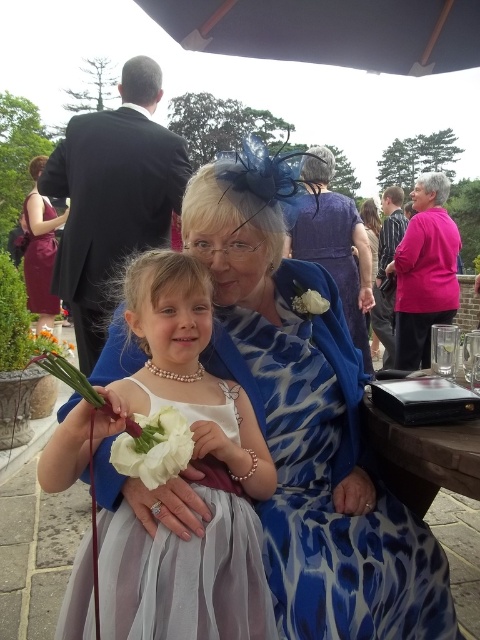
Question: Can you confirm if blue textured dress at center is positioned above white satin dress at lower left?

Choices:
 (A) no
 (B) yes

Answer: (A)

Question: Which of these objects is positioned farthest from the blue textured dress at center?

Choices:
 (A) white silk flower at lower left
 (B) white silk flower at center
 (C) white satin dress at center

Answer: (A)

Question: Which point is closer to the camera?

Choices:
 (A) white satin dress at lower left
 (B) white silk flower at lower left

Answer: (A)

Question: Can you confirm if blue textured dress at center is smaller than white fabric flower at center?

Choices:
 (A) yes
 (B) no

Answer: (B)

Question: Is white satin dress at center to the right of white silk flower at center from the viewer's perspective?

Choices:
 (A) no
 (B) yes

Answer: (B)

Question: Which object is farther from the camera taking this photo?

Choices:
 (A) white satin dress at center
 (B) white silk flower at lower left

Answer: (B)